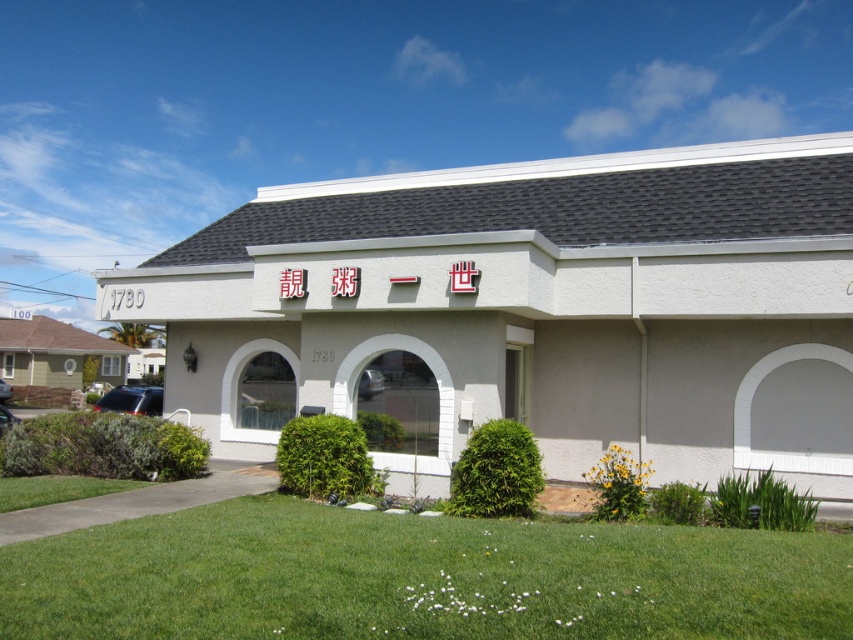
Does point (360, 396) come farther from viewer compared to point (628, 609)?

That is True.

Who is positioned more to the right, white stucco building at center or green grass at lower center?

white stucco building at center is more to the right.

Identify the location of white stucco building at center. (531, 310).

Find the location of `white stucco building at center`. white stucco building at center is located at coordinates (531, 310).